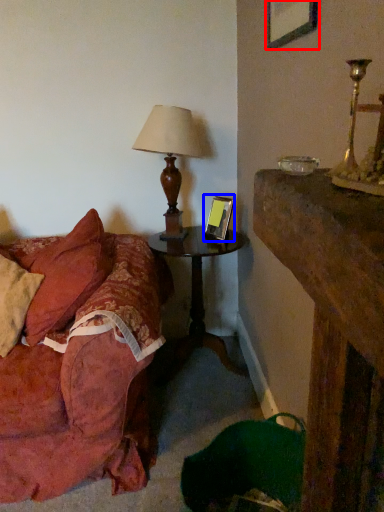
Question: Which object appears farthest to the camera in this image, picture frame (highlighted by a red box) or picture frame (highlighted by a blue box)?

Choices:
 (A) picture frame
 (B) picture frame

Answer: (B)